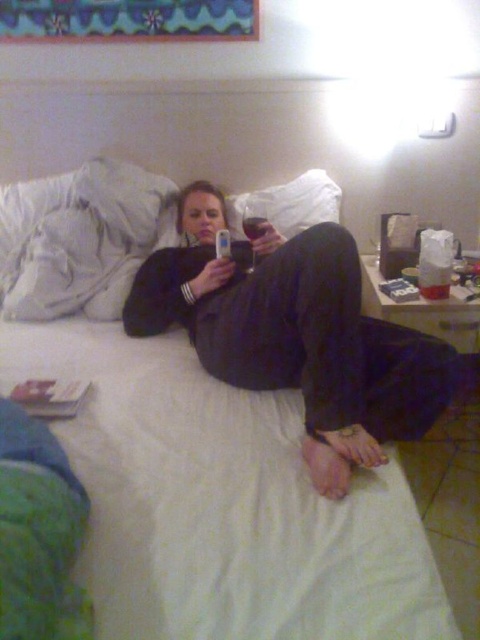
You are a hotel housekeeper entering the room to tidy up. You need to collect the matte black phone at center from its current position. However, there is a white fabric bed at center in the way. Can you move the bed to access the phone?

The white fabric bed at center is to the left of the matte black phone at center, so the bed is not blocking the phone. You can access the matte black phone at center without moving the bed.

You are standing in a hotel room and want to place a 12 inch long lamp on the white fabric bed at center. Can you fit it on the bed?

The white fabric bed at center and viewer are 33.69 inches apart. The distance between you and the bed is 33.69 inches, but the question is about the bed size. Since the bed size isn not provided, we cannot determine if the 12 inch lamp will fit. More information is needed.

From the picture: You are a photographer taking a picture of the scene. You want to focus on the matte black phone at center and the white soft pillow at upper left. Which object will appear larger in the photo?

The matte black phone at center will appear larger in the photo because it is closer to the viewer than the white soft pillow at upper left.